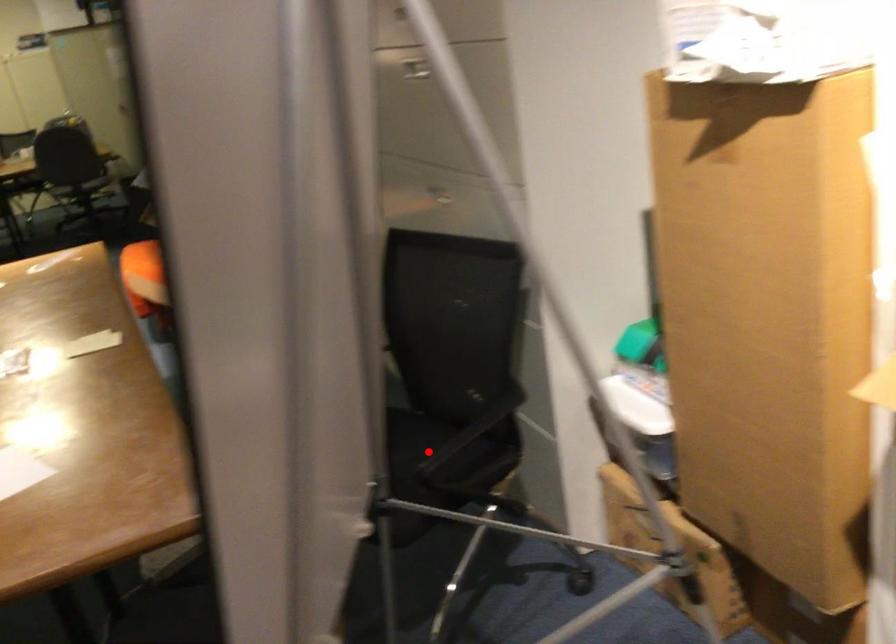
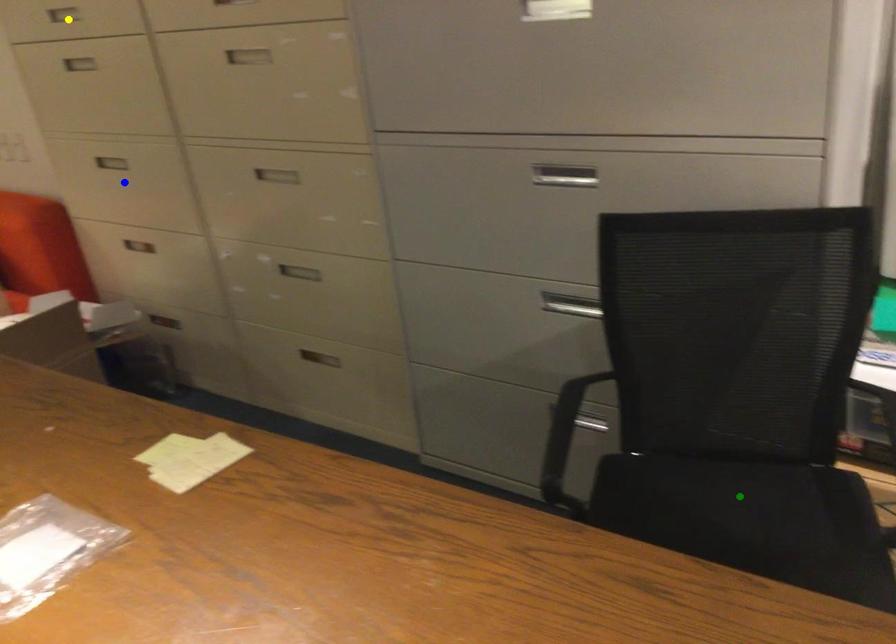
Question: I am providing you with two images of the same scene from different viewpoints. A red point is marked on the first image. You are given multiple points on the second image. Which mark in image 2 goes with the point in image 1?

Choices:
 (A) green point
 (B) yellow point
 (C) blue point

Answer: (A)